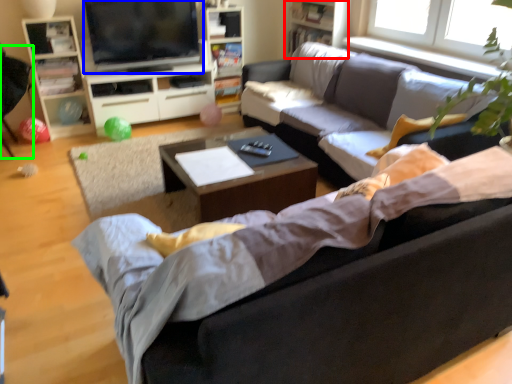
Question: Considering the real-world distances, which object is closest to bookshelf (highlighted by a red box)? television (highlighted by a blue box) or armchair (highlighted by a green box).

Choices:
 (A) television
 (B) armchair

Answer: (A)